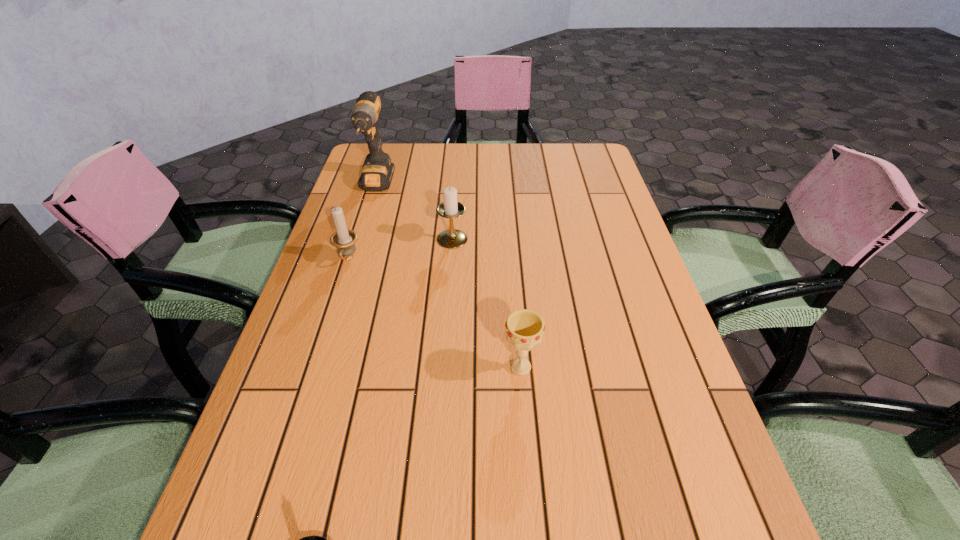
Where is `object positioned at the far edge`? The height and width of the screenshot is (540, 960). object positioned at the far edge is located at coordinates (377, 172).

Locate an element on the screen. Image resolution: width=960 pixels, height=540 pixels. drill at the left edge is located at coordinates (377, 172).

Find the location of `candle_holder present at the left edge`. candle_holder present at the left edge is located at coordinates (344, 240).

The image size is (960, 540). What are the coordinates of `object situated at the far left corner` in the screenshot? It's located at (377, 172).

Identify the location of free location at the far edge. This screenshot has height=540, width=960. (486, 151).

Find the location of a particular element. vacant region at the left edge is located at coordinates (333, 331).

Where is `vacant space at the right edge of the desktop`? vacant space at the right edge of the desktop is located at coordinates (657, 327).

At what (x,y) coordinates should I click in order to perform the action: click on unoccupied area between the rightmost candle holder and the leftmost candle holder. Please return your answer as a coordinate pair (x, y). Looking at the image, I should click on (400, 249).

Find the location of a particular element. The height and width of the screenshot is (540, 960). free space between the drill and the leftmost candle holder is located at coordinates (362, 222).

At what (x,y) coordinates should I click in order to perform the action: click on free space between the leftmost candle holder and the farthest object. Please return your answer as a coordinate pair (x, y). Image resolution: width=960 pixels, height=540 pixels. Looking at the image, I should click on (362, 222).